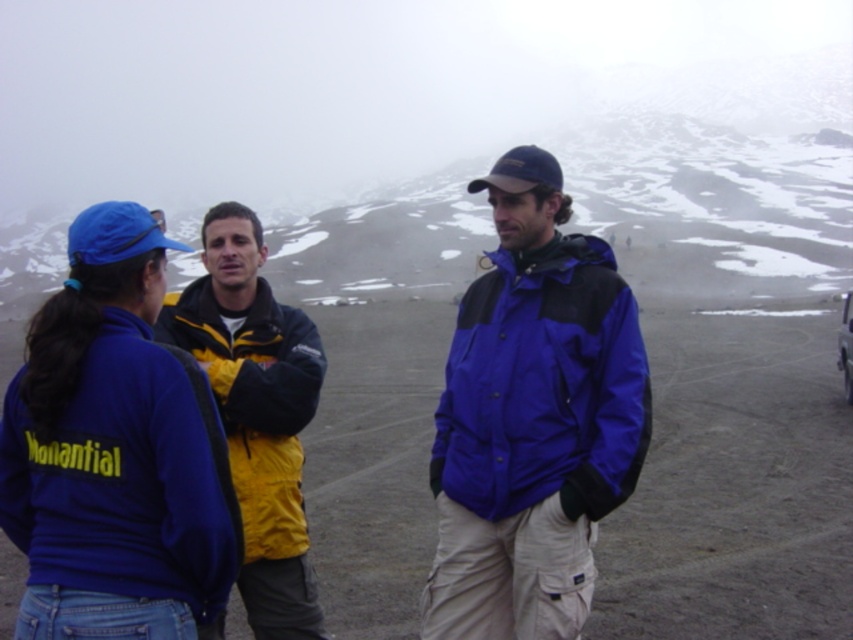
Question: Which of the following is the closest to the observer?

Choices:
 (A) (251, 621)
 (B) (576, 307)

Answer: (A)

Question: Which of the following is the farthest from the observer?

Choices:
 (A) (612, 278)
 (B) (207, 632)
 (C) (849, 344)

Answer: (C)

Question: Can you confirm if blue matte jacket at center is positioned below yellow fabric jacket at center?

Choices:
 (A) yes
 (B) no

Answer: (A)

Question: Among these objects, which one is nearest to the camera?

Choices:
 (A) metallic silver car at right
 (B) blue fleece jacket at left
 (C) blue matte jacket at center
 (D) yellow fabric jacket at center

Answer: (B)

Question: Is yellow fabric jacket at center positioned behind metallic silver car at right?

Choices:
 (A) yes
 (B) no

Answer: (B)

Question: Is yellow fabric jacket at center to the right of metallic silver car at right from the viewer's perspective?

Choices:
 (A) no
 (B) yes

Answer: (A)